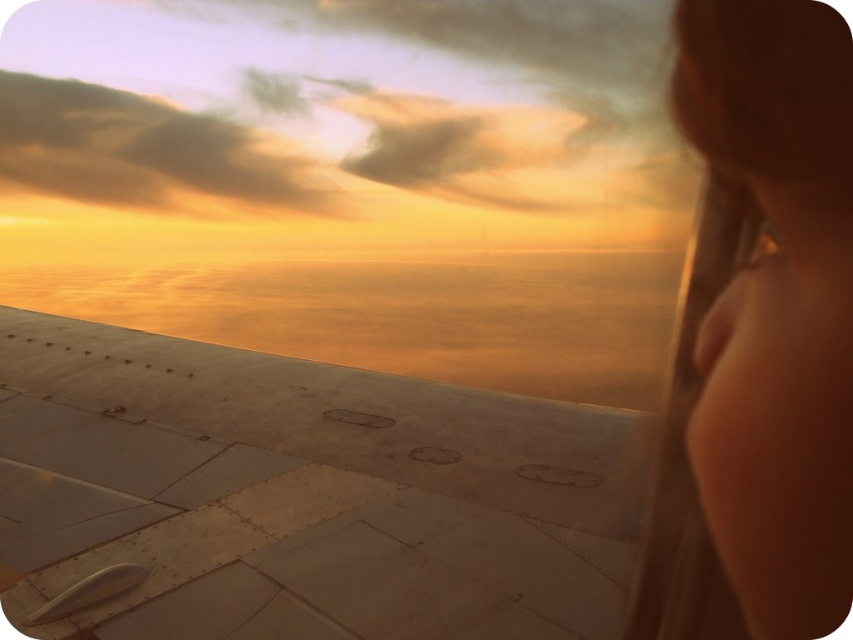
Between metallic gray wing at lower left and cloudy orange sky at upper left, which one has more height?

With more height is cloudy orange sky at upper left.

Between point (141, 465) and point (74, 106), which one is positioned in front?

Point (141, 465) is in front.

Is point (608, 536) positioned after point (216, 170)?

No, it is in front of (216, 170).

This screenshot has width=853, height=640. What are the coordinates of `metallic gray wing at lower left` in the screenshot? It's located at (303, 493).

Does metallic gray wing at lower left appear under smooth skin face at upper right?

Yes.

The height and width of the screenshot is (640, 853). What are the coordinates of `metallic gray wing at lower left` in the screenshot? It's located at (303, 493).

Is point (740, 88) positioned in front of point (282, 189)?

Yes, it is.

Between point (740, 342) and point (67, 195), which one is positioned in front?

Point (740, 342) is more forward.

Where is `smooth skin face at upper right`? smooth skin face at upper right is located at coordinates (758, 336).